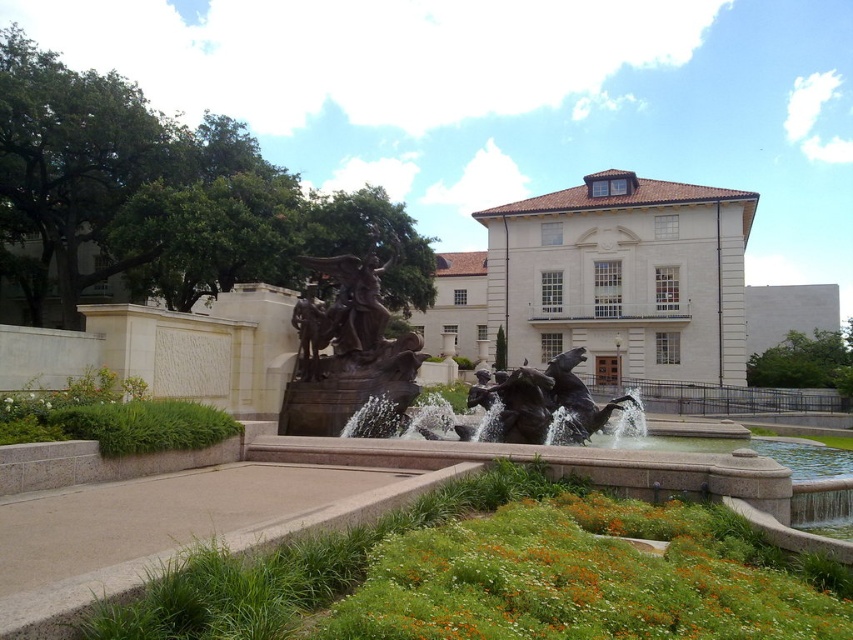
Question: Which of the following is the closest to the observer?

Choices:
 (A) bronze/statue at center
 (B) bronze/rough textured horse at center
 (C) green grass at lower center
 (D) white stone palace at center

Answer: (C)

Question: Does white stone palace at center have a lesser width compared to bronze/statue at center?

Choices:
 (A) yes
 (B) no

Answer: (B)

Question: Which of the following is the farthest from the observer?

Choices:
 (A) (323, 346)
 (B) (529, 410)
 (C) (419, 609)

Answer: (A)

Question: From the image, what is the correct spatial relationship of white stone palace at center in relation to bronze/statue at center?

Choices:
 (A) above
 (B) below

Answer: (A)

Question: Is the position of white stone palace at center more distant than that of bronze/statue at center?

Choices:
 (A) no
 (B) yes

Answer: (A)

Question: Estimate the real-world distances between objects in this image. Which object is farther from the bronze/statue at center?

Choices:
 (A) bronze/rough textured horse at center
 (B) green grass at lower center

Answer: (B)